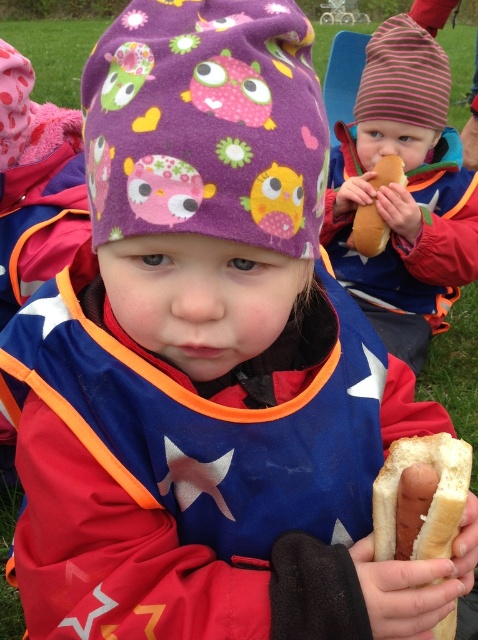
Who is lower down, striped knit hat at upper right or white soft hot dog at center?

white soft hot dog at center

Who is more distant from viewer, (423, 243) or (369, 204)?

Point (369, 204)

Which is behind, point (381, 48) or point (364, 252)?

The point (364, 252) is more distant.

The width and height of the screenshot is (478, 640). What are the coordinates of `striped knit hat at upper right` in the screenshot? It's located at (403, 193).

Does striped knit hat at upper right appear on the left side of white soft bread at center?

In fact, striped knit hat at upper right is to the right of white soft bread at center.

Which is in front, point (380, 296) or point (394, 452)?

Point (394, 452)

Between point (401, 253) and point (451, 540), which one is positioned in front?

Positioned in front is point (451, 540).

You are a GUI agent. You are given a task and a screenshot of the screen. Output one action in this format:
    pyautogui.click(x=<x>, y=<y>)
    Task: Click on the striped knit hat at upper right
    The width and height of the screenshot is (478, 640).
    Given the screenshot: What is the action you would take?
    pyautogui.click(x=403, y=193)

Between point (440, 508) and point (380, 166), which one is positioned in front?

Positioned in front is point (440, 508).

Who is more forward, (402, 449) or (365, 234)?

Point (402, 449)

Where is `white soft bread at center`? This screenshot has width=478, height=640. white soft bread at center is located at coordinates (433, 493).